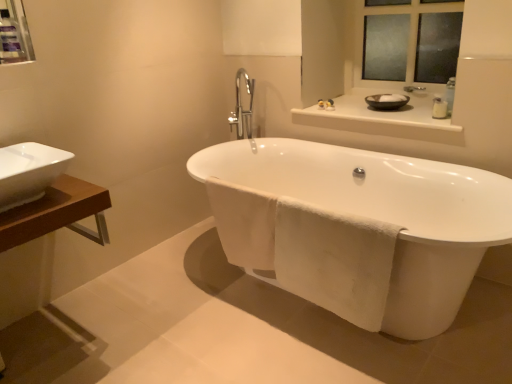
What do you see at coordinates (382, 117) in the screenshot?
I see `white glossy counter top at upper center` at bounding box center [382, 117].

At what (x,y) coordinates should I click in order to perform the action: click on glossy ceramic mirror at upper center. Please return your answer as a coordinate pair (x, y). The image size is (512, 384). Looking at the image, I should click on (412, 40).

At what (x,y) coordinates should I click in order to perform the action: click on white glossy bathtub at center. Please return your answer as a coordinate pair (x, y). This screenshot has width=512, height=384. Looking at the image, I should click on (x=386, y=214).

Considering the sizes of objects white plastic bottle at upper right and white glossy counter top at upper center in the image provided, who is wider, white plastic bottle at upper right or white glossy counter top at upper center?

Wider between the two is white glossy counter top at upper center.

Measure the distance from white plastic bottle at upper right to white glossy counter top at upper center.

The distance of white plastic bottle at upper right from white glossy counter top at upper center is 10.62 inches.

Is white plastic bottle at upper right positioned with its back to white glossy counter top at upper center?

No, white plastic bottle at upper right's orientation is not away from white glossy counter top at upper center.

From a real-world perspective, is white plastic bottle at upper right positioned above or below white glossy counter top at upper center?

white plastic bottle at upper right is situated higher than white glossy counter top at upper center in the real world.

Is white glossy bathtub at center not near white glossy counter top at upper center?

Actually, white glossy bathtub at center and white glossy counter top at upper center are a little close together.

Would you say white glossy bathtub at center is outside white glossy counter top at upper center?

Yes, white glossy bathtub at center is not within white glossy counter top at upper center.

Which of these two, white glossy bathtub at center or white glossy counter top at upper center, stands taller?

white glossy bathtub at center is taller.

Considering the positions of point (375, 171) and point (440, 94), is point (375, 171) closer or farther from the camera than point (440, 94)?

Clearly, point (375, 171) is closer to the camera than point (440, 94).

The image size is (512, 384). Identify the location of toiletry above the white ceramic sink at left (from a real-world perspective). (439, 108).

Which is closer to the camera, (438, 110) or (50, 167)?

Point (438, 110).

From the image's perspective, is white plastic bottle at upper right above or below white ceramic sink at left?

Based on their image positions, white plastic bottle at upper right is located above white ceramic sink at left.

Is white plastic bottle at upper right bigger or smaller than white ceramic sink at left?

Considering their sizes, white plastic bottle at upper right takes up less space than white ceramic sink at left.

Is white glossy counter top at upper center shorter than white ceramic sink at left?

Yes.

Is white glossy counter top at upper center positioned far away from white ceramic sink at left?

Indeed, white glossy counter top at upper center is not near white ceramic sink at left.

From the image's perspective, which one is positioned higher, white glossy counter top at upper center or white ceramic sink at left?

white glossy counter top at upper center.

Based on the photo, is white glossy counter top at upper center at the right side of white ceramic sink at left?

Indeed, white glossy counter top at upper center is positioned on the right side of white ceramic sink at left.

From a real-world perspective, who is located lower, glossy ceramic mirror at upper center or matte plastic medicine cabinet at upper left?

glossy ceramic mirror at upper center, from a real-world perspective.

Consider the image. Is glossy ceramic mirror at upper center completely or partially outside of matte plastic medicine cabinet at upper left?

glossy ceramic mirror at upper center lies outside matte plastic medicine cabinet at upper left's area.

Which is more distant, (458, 13) or (2, 55)?

The point (458, 13) is behind.

Considering the sizes of objects glossy ceramic mirror at upper center and matte plastic medicine cabinet at upper left in the image provided, who is shorter, glossy ceramic mirror at upper center or matte plastic medicine cabinet at upper left?

matte plastic medicine cabinet at upper left is shorter.

From a real-world perspective, which object stands above the other?

glossy ceramic mirror at upper center, from a real-world perspective.

Which point is more forward, (371, 32) or (442, 105)?

The point (442, 105) is more forward.

From the picture: Is glossy ceramic mirror at upper center in contact with white plastic bottle at upper right?

No.

Is white plastic bottle at upper right beside matte plastic medicine cabinet at upper left?

white plastic bottle at upper right and matte plastic medicine cabinet at upper left are clearly separated.

Consider the image. How far apart are white plastic bottle at upper right and matte plastic medicine cabinet at upper left?

white plastic bottle at upper right and matte plastic medicine cabinet at upper left are 6.71 feet apart from each other.

Is white plastic bottle at upper right positioned before matte plastic medicine cabinet at upper left?

No, it is not.

Based on the photo, is white plastic bottle at upper right spatially inside matte plastic medicine cabinet at upper left, or outside of it?

white plastic bottle at upper right is outside matte plastic medicine cabinet at upper left.

Where is `toiletry below the white glossy counter top at upper center (from the image's perspective)`? The height and width of the screenshot is (384, 512). toiletry below the white glossy counter top at upper center (from the image's perspective) is located at coordinates (439, 108).

Identify the location of counter top located above the white glossy bathtub at center (from the image's perspective). (382, 117).

Based on the photo, based on their spatial positions, is white glossy bathtub at center or glossy ceramic mirror at upper center closer to white glossy counter top at upper center?

glossy ceramic mirror at upper center is closer to white glossy counter top at upper center.

Looking at the image, which one is located closer to glossy ceramic mirror at upper center, white plastic bottle at upper right or white glossy counter top at upper center?

white glossy counter top at upper center is closer to glossy ceramic mirror at upper center.

From the image, which object appears to be nearer to white glossy counter top at upper center, white plastic bottle at upper right or glossy ceramic mirror at upper center?

Based on the image, white plastic bottle at upper right appears to be nearer to white glossy counter top at upper center.

From the image, which object appears to be farther from white plastic bottle at upper right, white glossy counter top at upper center or white ceramic sink at left?

Based on the image, white ceramic sink at left appears to be further to white plastic bottle at upper right.

From the picture: Based on their spatial positions, is white glossy bathtub at center or white ceramic sink at left closer to white plastic bottle at upper right?

white glossy bathtub at center lies closer to white plastic bottle at upper right than the other object.

Which object lies further to the anchor point white ceramic sink at left, white glossy bathtub at center or matte plastic medicine cabinet at upper left?

white glossy bathtub at center is further to white ceramic sink at left.

Looking at the image, which one is located further to matte plastic medicine cabinet at upper left, black ceramic basin at upper right or white glossy bathtub at center?

black ceramic basin at upper right is positioned further to the anchor matte plastic medicine cabinet at upper left.

Looking at the image, which one is located closer to white glossy counter top at upper center, black ceramic basin at upper right or glossy ceramic mirror at upper center?

black ceramic basin at upper right is positioned closer to the anchor white glossy counter top at upper center.

The height and width of the screenshot is (384, 512). Identify the location of sink situated between matte plastic medicine cabinet at upper left and white glossy bathtub at center from left to right. (28, 172).

Image resolution: width=512 pixels, height=384 pixels. In order to click on bathtub between matte plastic medicine cabinet at upper left and glossy ceramic mirror at upper center in the horizontal direction in this screenshot , I will do (386, 214).

The width and height of the screenshot is (512, 384). In order to click on sink between matte plastic medicine cabinet at upper left and glossy ceramic mirror at upper center from left to right in this screenshot , I will do `click(28, 172)`.

Where is `toiletry located between white glossy bathtub at center and black ceramic basin at upper right in the depth direction`? The image size is (512, 384). toiletry located between white glossy bathtub at center and black ceramic basin at upper right in the depth direction is located at coordinates (439, 108).